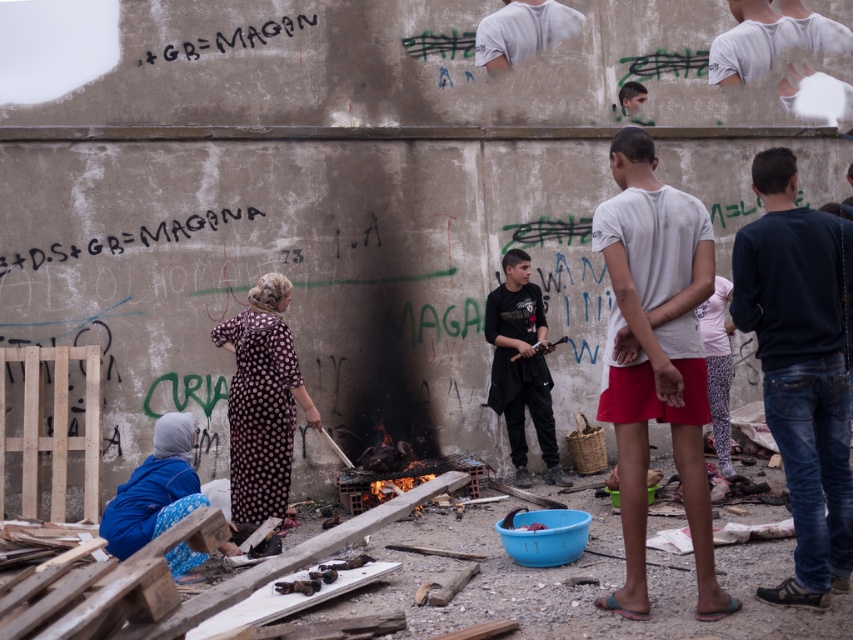
You are standing in front of the graffiti wall and see the white cotton shirt at center and the white leopard print leggings at center. Which item is nearer to you?

The white cotton shirt at center is closer to the viewer than the white leopard print leggings at center, so the shirt is nearer.

You are an observer standing in front of the concrete wall with graffiti. You notice a black matte shirt at center and a black graffiti at upper center. Which object is taller?

The black matte shirt at center is taller than the black graffiti at upper center.